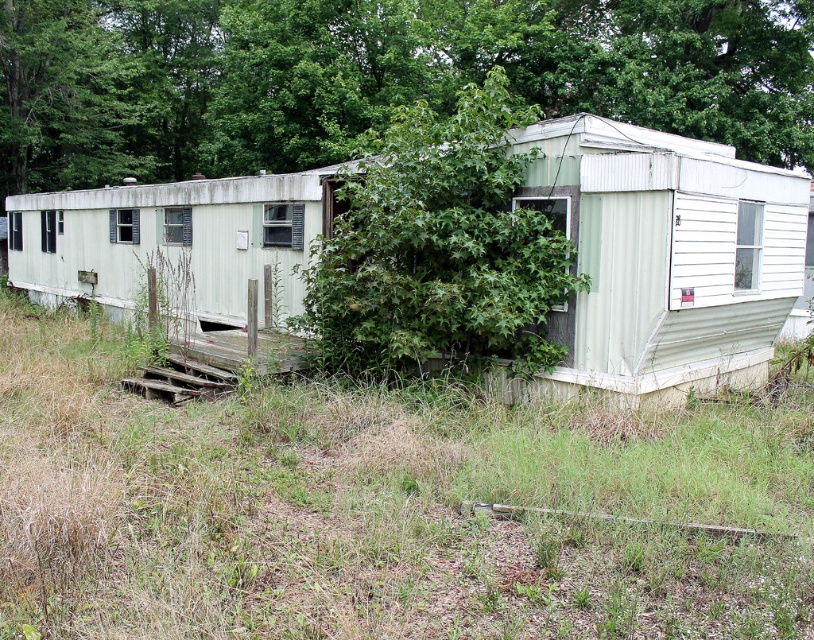
You are standing at the entrance of the mobile home and want to walk towards the green leafy tree at upper center. Which direction should you move relative to the green grass at lower center?

To reach the green leafy tree at upper center, you should move to the left side of the green grass at lower center since the green grass at lower center is positioned on the right side of the green leafy tree at upper center.

You are standing at the edge of the property and want to walk towards the mobile home. Which direction should you head relative to the green leafy tree at upper center and the green grass at lower center?

You should head towards the green grass at lower center, which is located below the green leafy tree at upper center, so you should walk downward from the tree towards the grass to reach the mobile home.